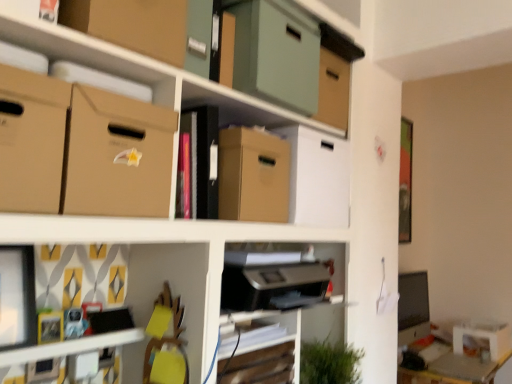
Question: From a real-world perspective, is matte brown cardboard box at upper left, the first cardboard box in the top-to-bottom sequence, under wooden table at lower right?

Choices:
 (A) yes
 (B) no

Answer: (B)

Question: Is matte brown cardboard box at upper left, arranged as the 5th cardboard box when ordered from the bottom, positioned beyond the bounds of wooden table at lower right?

Choices:
 (A) no
 (B) yes

Answer: (B)

Question: Is matte brown cardboard box at upper left, arranged as the 5th cardboard box when ordered from the bottom, looking in the opposite direction of wooden table at lower right?

Choices:
 (A) no
 (B) yes

Answer: (A)

Question: Considering the relative sizes of matte brown cardboard box at upper left, the first cardboard box in the top-to-bottom sequence, and wooden table at lower right in the image provided, is matte brown cardboard box at upper left, the first cardboard box in the top-to-bottom sequence, shorter than wooden table at lower right?

Choices:
 (A) yes
 (B) no

Answer: (A)

Question: Does matte brown cardboard box at upper left, the first cardboard box in the top-to-bottom sequence, come in front of wooden table at lower right?

Choices:
 (A) no
 (B) yes

Answer: (B)

Question: From a real-world perspective, is matte cardboard boxes at upper center above or below matte plastic toy at lower left?

Choices:
 (A) above
 (B) below

Answer: (A)

Question: From the image's perspective, is matte cardboard boxes at upper center above or below matte plastic toy at lower left?

Choices:
 (A) above
 (B) below

Answer: (A)

Question: Is point (52, 96) closer or farther from the camera than point (67, 334)?

Choices:
 (A) closer
 (B) farther

Answer: (A)

Question: In terms of size, does matte cardboard boxes at upper center appear bigger or smaller than matte plastic toy at lower left?

Choices:
 (A) small
 (B) big

Answer: (B)

Question: In terms of width, does matte brown cardboard box at upper left, the first cardboard box in the top-to-bottom sequence, look wider or thinner when compared to wooden swivel chair at lower center?

Choices:
 (A) thin
 (B) wide

Answer: (B)

Question: Considering their positions, is matte brown cardboard box at upper left, the first cardboard box in the top-to-bottom sequence, located in front of or behind wooden swivel chair at lower center?

Choices:
 (A) behind
 (B) front

Answer: (B)

Question: From their relative heights in the image, would you say matte brown cardboard box at upper left, arranged as the 5th cardboard box when ordered from the bottom, is taller or shorter than wooden swivel chair at lower center?

Choices:
 (A) short
 (B) tall

Answer: (A)

Question: From the image's perspective, relative to wooden swivel chair at lower center, is matte brown cardboard box at upper left, arranged as the 5th cardboard box when ordered from the bottom, above or below?

Choices:
 (A) above
 (B) below

Answer: (A)

Question: From the image's perspective, is brown cardboard box at center, which is counted as the 5th cardboard box, starting from the top, located above or below wooden swivel chair at lower center?

Choices:
 (A) above
 (B) below

Answer: (A)

Question: Considering the relative positions of brown cardboard box at center, positioned as the 1th cardboard box in bottom-to-top order, and wooden swivel chair at lower center in the image provided, is brown cardboard box at center, positioned as the 1th cardboard box in bottom-to-top order, to the left or to the right of wooden swivel chair at lower center?

Choices:
 (A) left
 (B) right

Answer: (B)